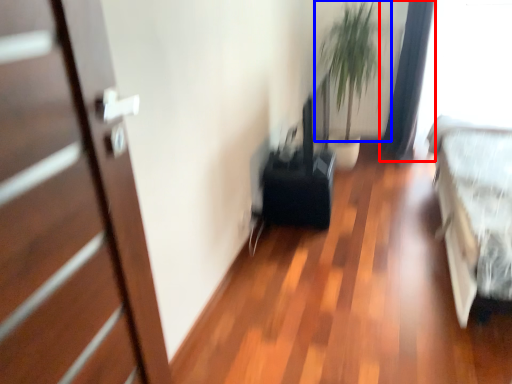
Question: Which of the following is the closest to the observer, curtain (highlighted by a red box) or plant (highlighted by a blue box)?

Choices:
 (A) curtain
 (B) plant

Answer: (A)